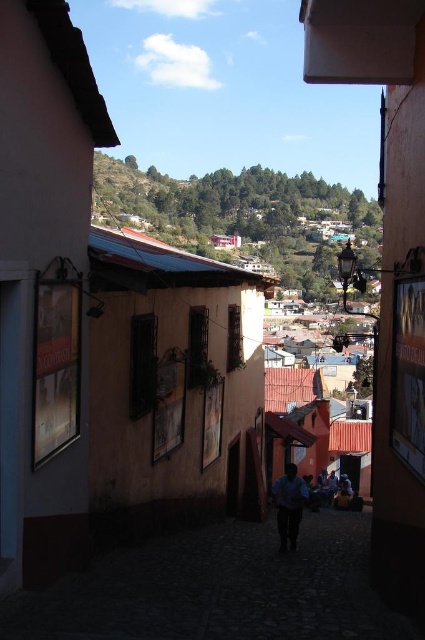
Question: Which point is closer to the camera?

Choices:
 (A) (221, 278)
 (B) (286, 500)
 (C) (271, 586)

Answer: (C)

Question: Which point appears closest to the camera in this image?

Choices:
 (A) (299, 515)
 (B) (246, 570)

Answer: (B)

Question: Can you confirm if matte orange building at center is positioned above dark stone alley at center?

Choices:
 (A) no
 (B) yes

Answer: (B)

Question: Is dark stone alley at center bigger than blue fabric shirt at center?

Choices:
 (A) yes
 (B) no

Answer: (A)

Question: Is matte orange building at center above blue fabric shirt at center?

Choices:
 (A) no
 (B) yes

Answer: (B)

Question: Which point is farther to the camera?

Choices:
 (A) (286, 500)
 (B) (121, 170)
 (C) (133, 600)

Answer: (B)